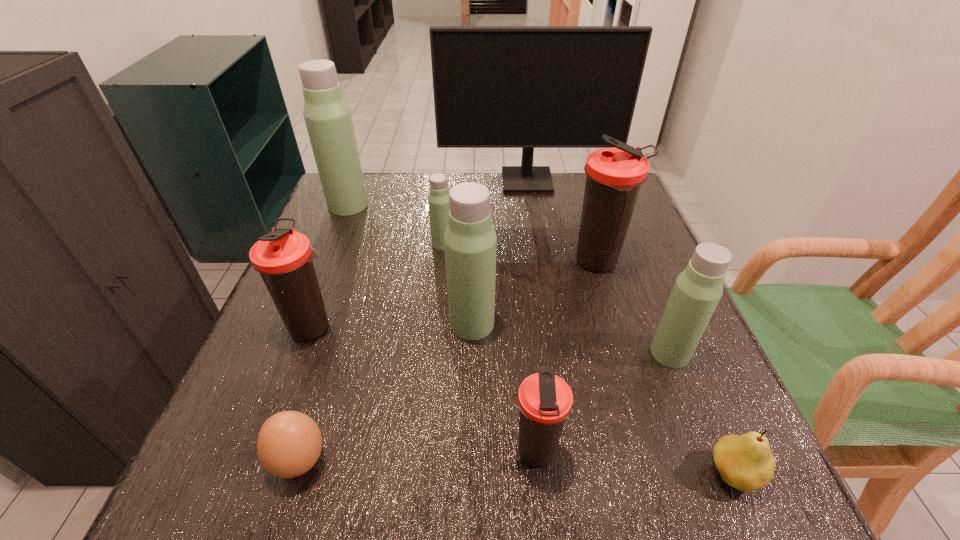
Locate an element on the screen. The image size is (960, 540). vacant space that is in between the biggest brown thermos bottle and the boiled egg is located at coordinates 449,361.

Locate an element on the screen. object that can be found as the eighth closest to the leftmost brown thermos bottle is located at coordinates (697, 290).

The width and height of the screenshot is (960, 540). I want to click on object that ranks as the fifth closest to the farthest object, so click(x=283, y=257).

Where is `thermos bottle that stands as the fourth closest to the rightmost light thermos bottle`? The width and height of the screenshot is (960, 540). thermos bottle that stands as the fourth closest to the rightmost light thermos bottle is located at coordinates (438, 200).

You are a GUI agent. You are given a task and a screenshot of the screen. Output one action in this format:
    pyautogui.click(x=<x>, y=<y>)
    Task: Click on the thermos bottle that is the second closest to the nearest thermos bottle
    
    Given the screenshot: What is the action you would take?
    pyautogui.click(x=697, y=290)

Locate an element on the screen. This screenshot has height=540, width=960. the third closest light thermos bottle to the rightmost brown thermos bottle is located at coordinates (438, 200).

Image resolution: width=960 pixels, height=540 pixels. In order to click on light thermos bottle that is the second nearest to the farthest thermos bottle in this screenshot , I will do `click(470, 241)`.

This screenshot has width=960, height=540. Find the location of `brown thermos bottle that is the closest one to the leftmost brown thermos bottle`. brown thermos bottle that is the closest one to the leftmost brown thermos bottle is located at coordinates (545, 400).

Locate an element on the screen. The image size is (960, 540). brown thermos bottle that is the nearest to the nearest brown thermos bottle is located at coordinates (614, 177).

Identify the location of free space that satisfies the following two spatial constraints: 1. on the front side of the farthest thermos bottle; 2. on the left side of the farthest brown thermos bottle. This screenshot has width=960, height=540. (325, 262).